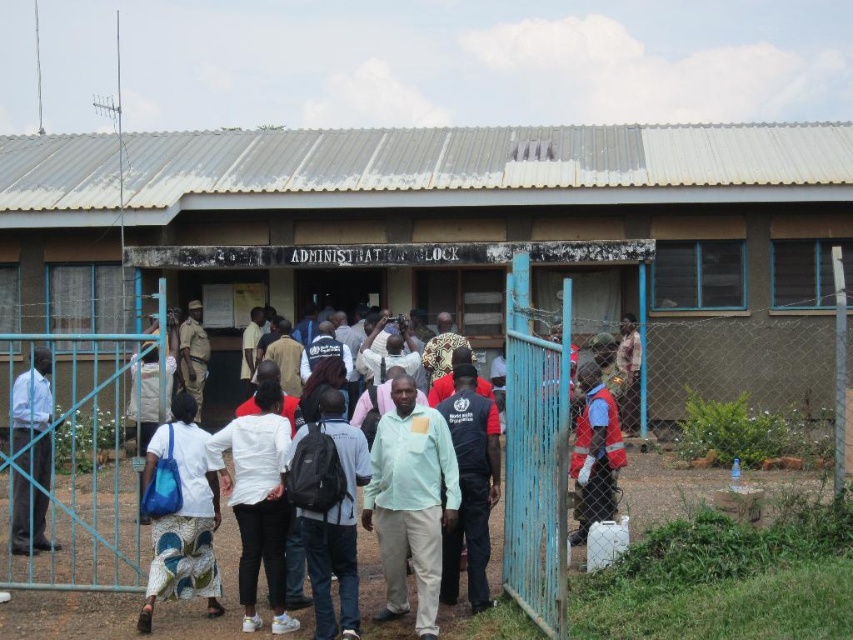
Find the location of a particular element. black backpack at center is located at coordinates (335, 525).

What do you see at coordinates (335, 525) in the screenshot?
I see `black backpack at center` at bounding box center [335, 525].

The image size is (853, 640). I want to click on black backpack at center, so click(x=335, y=525).

Which of these two, white fabric skirt at lower left or blue fabric shirt at center, stands taller?

Standing taller between the two is blue fabric shirt at center.

Can you confirm if white fabric skirt at lower left is positioned above blue fabric shirt at center?

No, white fabric skirt at lower left is not above blue fabric shirt at center.

The image size is (853, 640). I want to click on white fabric skirt at lower left, so click(183, 516).

Identify the location of white fabric skirt at lower left. (183, 516).

You are a GUI agent. You are given a task and a screenshot of the screen. Output one action in this format:
    pyautogui.click(x=<x>, y=<y>)
    Task: Click on the white matte shirt at center
    The width and height of the screenshot is (853, 640).
    Given the screenshot: What is the action you would take?
    pyautogui.click(x=259, y=500)

Does point (227, 440) lie behind point (497, 417)?

No, it is not.

Which is behind, point (258, 500) or point (473, 371)?

Point (473, 371)

Locate an element on the screen. white matte shirt at center is located at coordinates (259, 500).